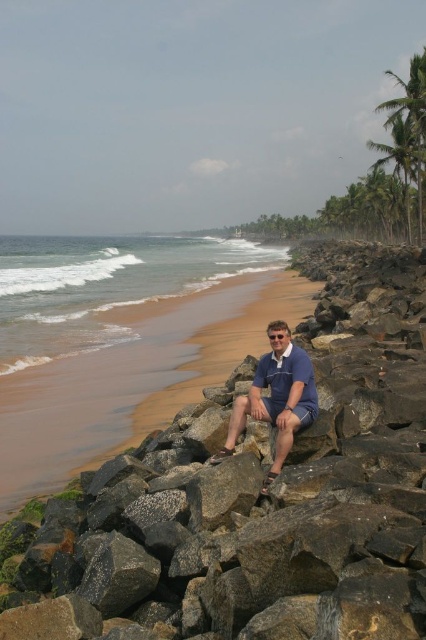
Based on the photo, does gray rough rock at center come behind blue cotton shirt at center?

No, it is in front of blue cotton shirt at center.

What do you see at coordinates (256, 492) in the screenshot? I see `gray rough rock at center` at bounding box center [256, 492].

Who is more forward, (180, 580) or (290, 417)?

Point (180, 580)

Identify the location of gray rough rock at center. (256, 492).

How distant is brown sand at lower left from blue cotton shirt at center?

A distance of 9.10 meters exists between brown sand at lower left and blue cotton shirt at center.

Can you confirm if brown sand at lower left is positioned to the right of blue cotton shirt at center?

No, brown sand at lower left is not to the right of blue cotton shirt at center.

What do you see at coordinates (127, 381) in the screenshot?
I see `brown sand at lower left` at bounding box center [127, 381].

At what (x,y) coordinates should I click in order to perform the action: click on brown sand at lower left. Please return your answer as a coordinate pair (x, y). The height and width of the screenshot is (640, 426). Looking at the image, I should click on (127, 381).

Who is more forward, (58, 552) or (416, 58)?

Point (58, 552) is more forward.

Can you confirm if gray rough rock at center is positioned to the left of green leafy palm tree at upper right?

Indeed, gray rough rock at center is positioned on the left side of green leafy palm tree at upper right.

Describe the element at coordinates (256, 492) in the screenshot. I see `gray rough rock at center` at that location.

Locate an element on the screen. Image resolution: width=426 pixels, height=640 pixels. gray rough rock at center is located at coordinates (256, 492).